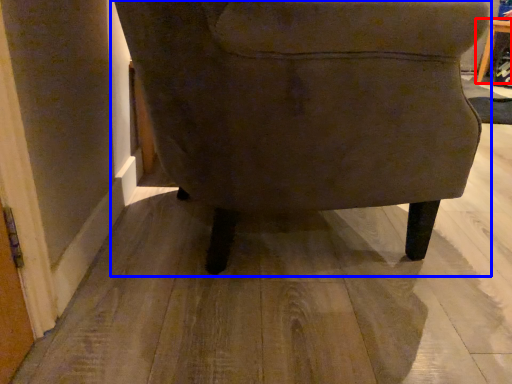
Question: Which of the following is the closest to the observer, table (highlighted by a red box) or chair (highlighted by a blue box)?

Choices:
 (A) table
 (B) chair

Answer: (B)